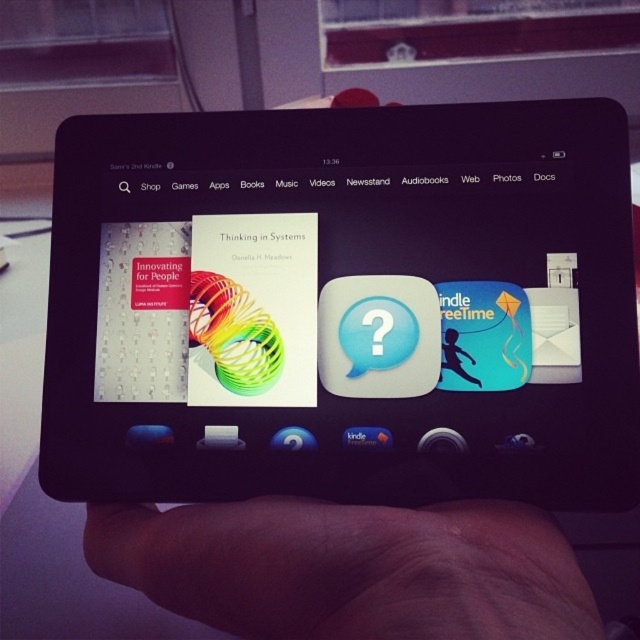
You are trying to take a photo of the black glossy tablet at center and the skinny flesh at lower center. Which object should you focus on first to ensure both are in focus?

You should focus on the skinny flesh at lower center first because it is closer to you than the black glossy tablet at center, which is further away. This way, both objects will be in focus when using a camera with a shallow depth of field.

You are looking at the screen of a Kindle Fire tablet. You see two points labeled as point 1 at coordinates (x=86, y=394) and point 2 at coordinates (x=436, y=616). From your perspective, which point is closer to you?

Point 1 at coordinates (x=86, y=394) is closer to you because it is in front of point 2 at coordinates (x=436, y=616).

Where is the black glossy tablet at center located in the image?

The black glossy tablet at center is located at point (342, 304).